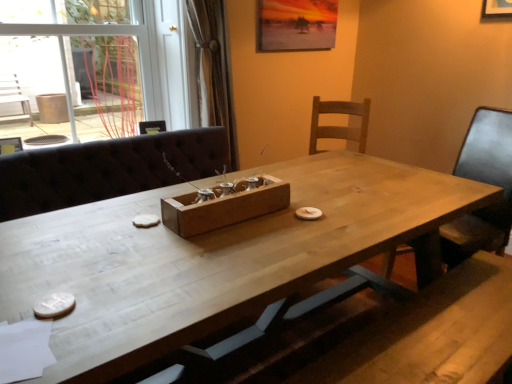
Image resolution: width=512 pixels, height=384 pixels. I want to click on free spot to the right of wooden tray at center, so click(x=308, y=221).